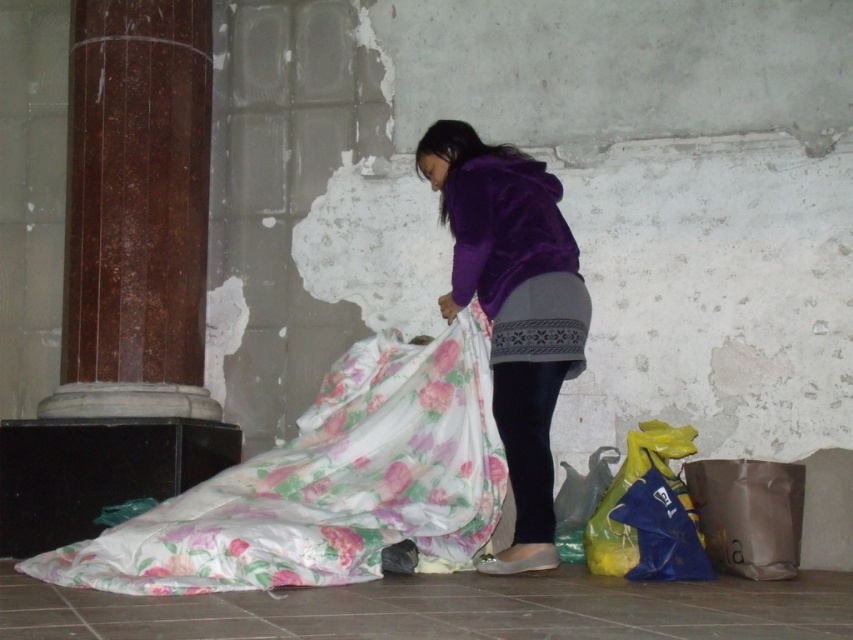
Question: Considering the relative positions of floral satin blanket at lower left and yellow plastic bag at lower right in the image provided, where is floral satin blanket at lower left located with respect to yellow plastic bag at lower right?

Choices:
 (A) left
 (B) right

Answer: (A)

Question: Based on their relative distances, which object is farther from the matte brown paper bag at lower right?

Choices:
 (A) yellow plastic bag at lower right
 (B) matte green plastic bag at lower right

Answer: (B)

Question: Can you confirm if floral satin blanket at lower left is bigger than maroon polished column at left?

Choices:
 (A) no
 (B) yes

Answer: (B)

Question: Is yellow plastic bag at lower right wider than matte brown paper bag at lower right?

Choices:
 (A) yes
 (B) no

Answer: (A)

Question: Which of the following is the farthest from the observer?

Choices:
 (A) (607, 502)
 (B) (599, 474)
 (C) (123, 205)
 (D) (763, 513)

Answer: (C)

Question: Which point appears closest to the camera in this image?

Choices:
 (A) (773, 513)
 (B) (500, 252)

Answer: (A)